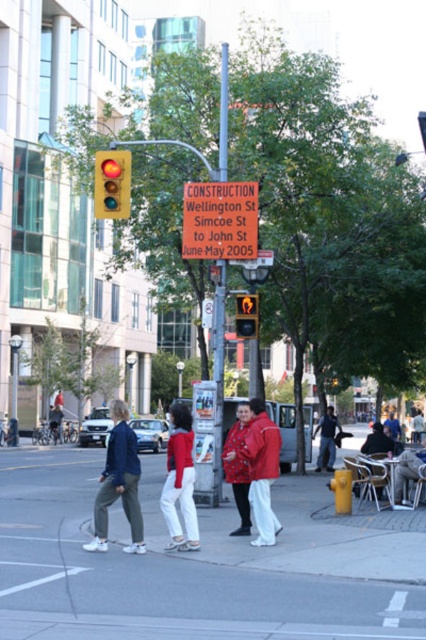
Question: Can you confirm if metallic pole at center is bigger than orange plastic sign at center?

Choices:
 (A) no
 (B) yes

Answer: (B)

Question: Which point is farther to the camera?

Choices:
 (A) (256, 330)
 (B) (51, 611)
 (C) (247, 480)
 (D) (213, 477)

Answer: (A)

Question: Which object is closer to the camera taking this photo?

Choices:
 (A) smooth gray statue at lower right
 (B) red fabric jacket at lower center
 (C) yellow matte traffic light at upper left
 (D) metallic pole at center

Answer: (A)

Question: Observing the image, what is the correct spatial positioning of yellow matte traffic light at upper left in reference to yellow plastic pedestrian signal at center?

Choices:
 (A) left
 (B) right

Answer: (A)

Question: Does red plastic construction sign at center have a larger size compared to matte red shirt at center?

Choices:
 (A) no
 (B) yes

Answer: (B)

Question: Which of these objects is positioned closest to the matte red jacket at center?

Choices:
 (A) red matte coat at center
 (B) red fabric jacket at lower center
 (C) smooth gray statue at lower right
 (D) yellow plastic pedestrian signal at center

Answer: (A)